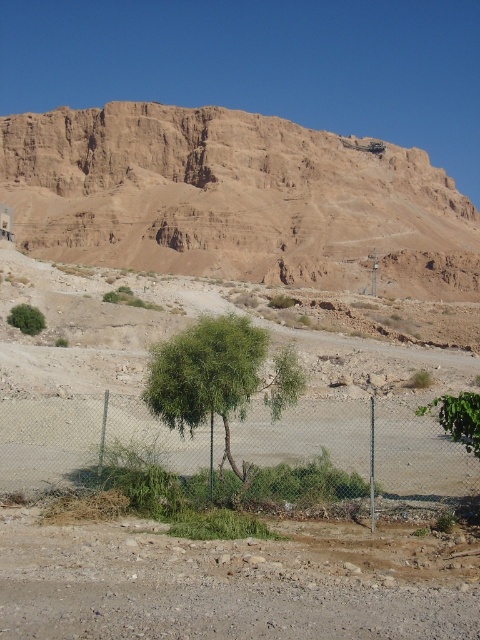
You are a geologist examining the desert landscape. You need to collect a sample from the brown gravelly dirt field at lower center. According to the coordinates provided, where exactly should you look for it?

The brown gravelly dirt field at lower center is located at point [230,580].

You are a hiker planning to cross the brown gravelly dirt field at lower center and reach the brown rocky mountain at upper center. Based on the scene, which object is bigger in size?

The brown rocky mountain at upper center is larger in size compared to the brown gravelly dirt field at lower center.

You are standing at the point with coordinates point (459,433) and want to walk towards the cliff in the background. Is the point point (88,445) between you and the cliff?

The point point (88,445) is behind point point (459,433), so it is not between you and the cliff in the background.